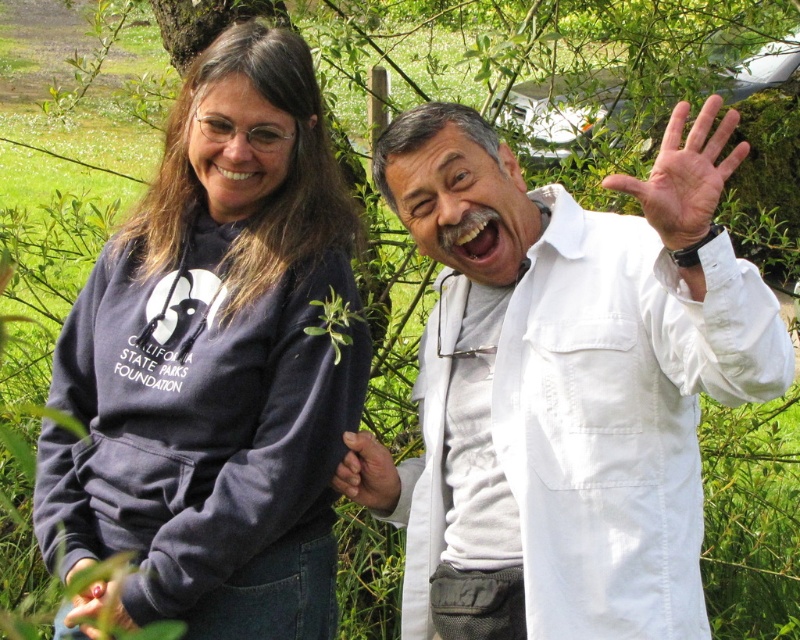
You are a photographer trying to capture a photo of the dark blue sweatshirt at left and the black matte hand at lower left. Which object should you focus on first if you want to ensure both are in sharp focus?

The dark blue sweatshirt at left is much taller than the black matte hand at lower left, so you should focus on the dark blue sweatshirt at left first to ensure both are in sharp focus.

You are a photographer trying to capture a photo of the white cotton lab coat at right and the white smooth hand at upper right. Since you want to ensure both are in focus, you need to know which object is taller. Can you determine which one is taller?

The white cotton lab coat at right is much taller than the white smooth hand at upper right, so you should focus on the white cotton lab coat at right first as it is taller.

You are a photographer trying to capture a closeup of the white smooth hand at upper right without including the white cotton lab coat at right. Given their sizes, is this possible?

The white cotton lab coat at right is larger in size than the white smooth hand at upper right. Since the lab coat is bigger, it might block the hand depending on their positions. However, since the hand is at upper right and the lab coat is at right, you can adjust the camera angle to focus solely on the hand without the lab coat being in frame.